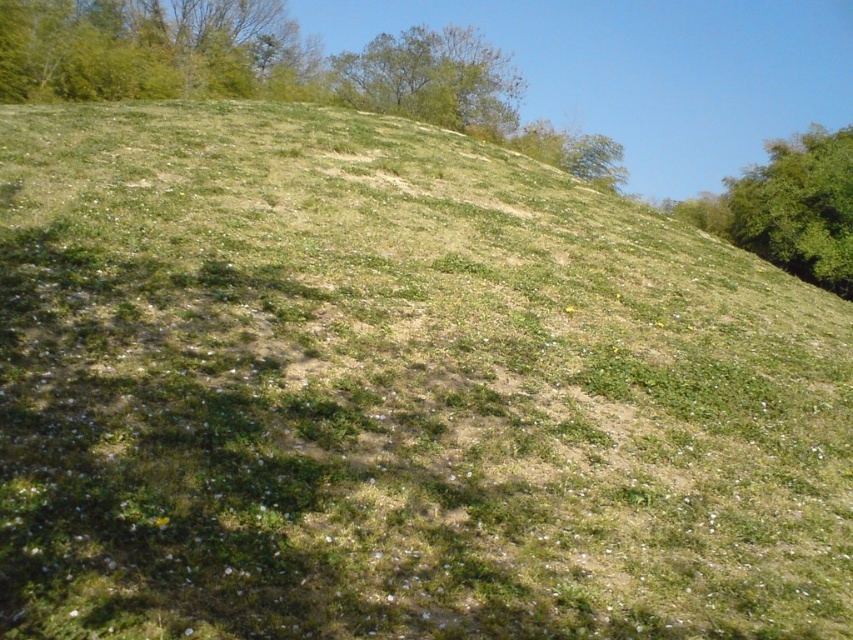
Does green leafy tree at upper left have a larger size compared to green leafy tree at upper right?

No.

Is green leafy tree at upper left wider than green leafy tree at upper right?

No, green leafy tree at upper left is not wider than green leafy tree at upper right.

Does point (82, 74) come farther from viewer compared to point (778, 221)?

No, (82, 74) is closer to viewer.

In order to click on green leafy tree at upper left in this screenshot , I will do `click(154, 51)`.

Is green leafy tree at upper right in front of green leafy tree at upper center?

Yes, green leafy tree at upper right is closer to the viewer.

Can you confirm if green leafy tree at upper right is positioned to the left of green leafy tree at upper center?

In fact, green leafy tree at upper right is to the right of green leafy tree at upper center.

Which is behind, point (844, 150) or point (427, 58)?

Point (427, 58)

You are a GUI agent. You are given a task and a screenshot of the screen. Output one action in this format:
    pyautogui.click(x=<x>, y=<y>)
    Task: Click on the green leafy tree at upper right
    The height and width of the screenshot is (640, 853).
    Given the screenshot: What is the action you would take?
    pyautogui.click(x=798, y=208)

Is green leafy tree at upper left taller than green leafy tree at upper center?

No, green leafy tree at upper left is not taller than green leafy tree at upper center.

Does point (199, 72) come in front of point (389, 106)?

Yes, it is in front of point (389, 106).

This screenshot has height=640, width=853. What do you see at coordinates (154, 51) in the screenshot?
I see `green leafy tree at upper left` at bounding box center [154, 51].

Locate an element on the screen. green leafy tree at upper left is located at coordinates (154, 51).